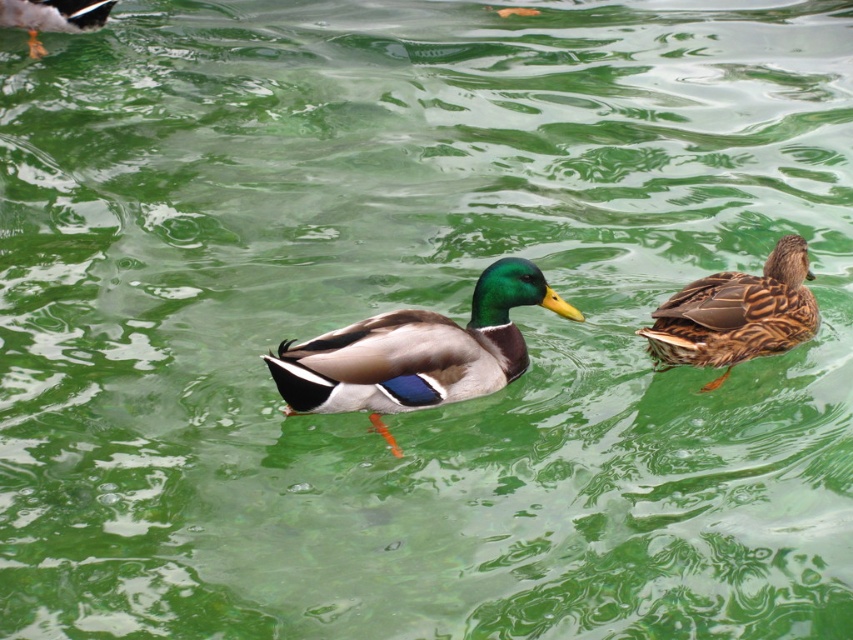
You are standing on the edge of the water and see the shiny green duck at center. If you want to throw a small pebble to make a ripple near the duck, will you be able to reach it with an average throw of 4 meters?

The shiny green duck at center is 3.96 meters away from the viewer. Since the average throw is 4 meters, you can reach it with a throw of 4 meters.

You are a photographer aiming to capture the shiny green duck at center. You have a camera with a zoom lens that can focus on objects within a 0.5 meter radius. The point you are currently focused on is at coordinates point (x=416, y=353). Is the shiny green duck at center within your current focus range?

The point (x=416, y=353) is where the shiny green duck at center is located, so yes, the shiny green duck at center is within the focus range of your camera since the focus point is exactly at its location.